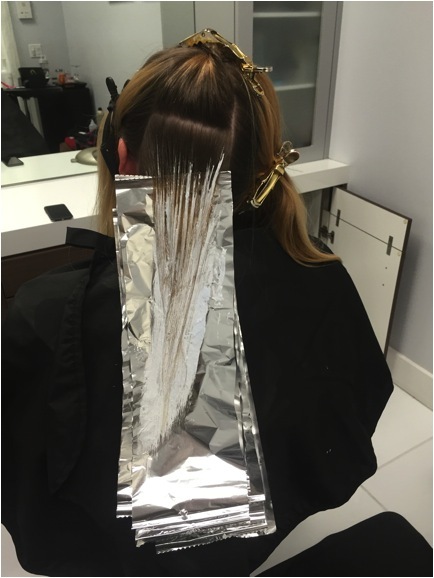
This screenshot has width=434, height=578. What are the coordinates of `wall` in the screenshot? It's located at (393, 155).